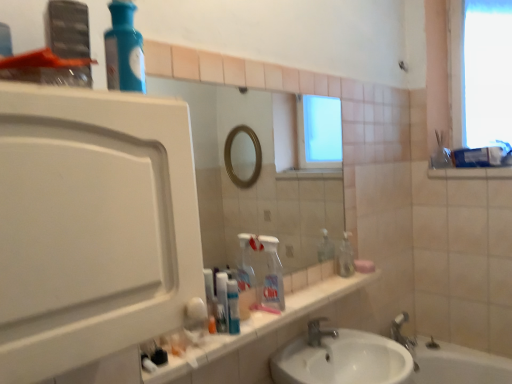
Image resolution: width=512 pixels, height=384 pixels. Identify the location of vacant region to the left of silver metallic faucet at sink center. (291, 353).